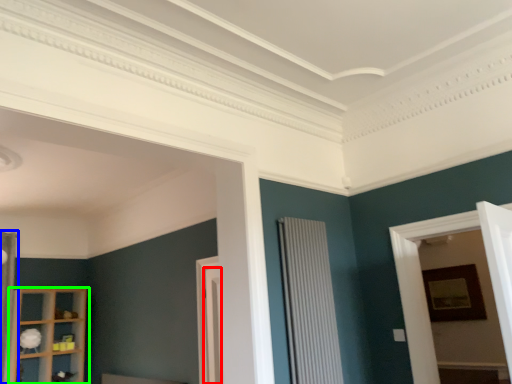
Question: Considering the real-world distances, which object is farthest from door (highlighted by a red box)? curtain (highlighted by a blue box) or shelf (highlighted by a green box)?

Choices:
 (A) curtain
 (B) shelf

Answer: (A)